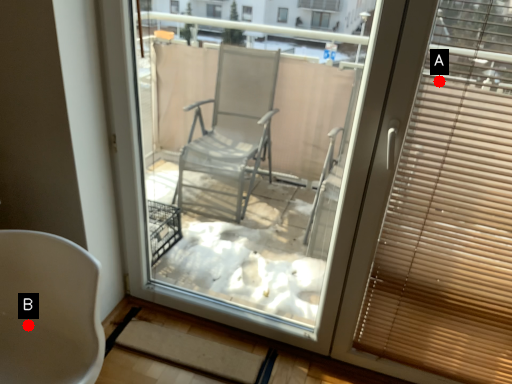
Question: Two points are circled on the image, labeled by A and B beside each circle. Among these points, which one is nearest to the camera?

Choices:
 (A) A is closer
 (B) B is closer

Answer: (A)